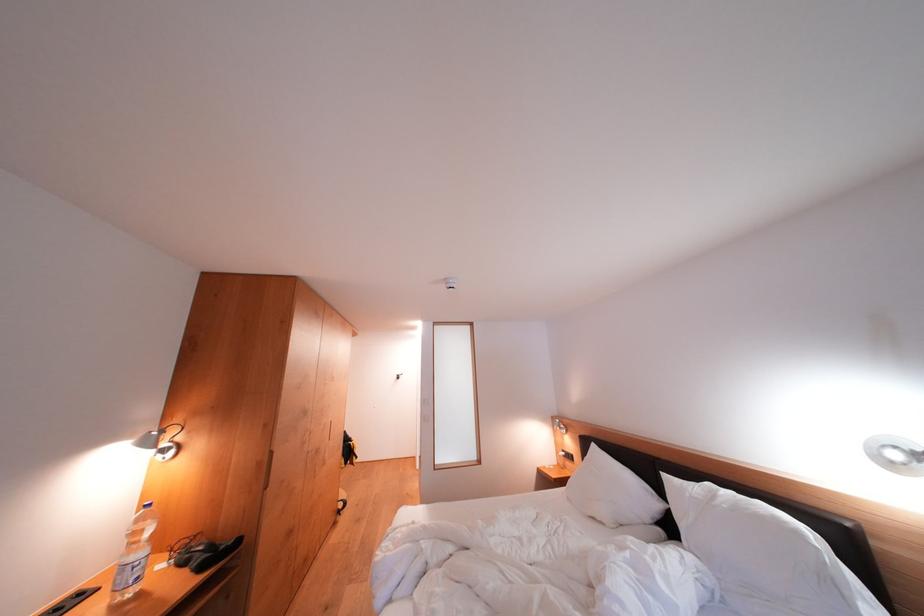
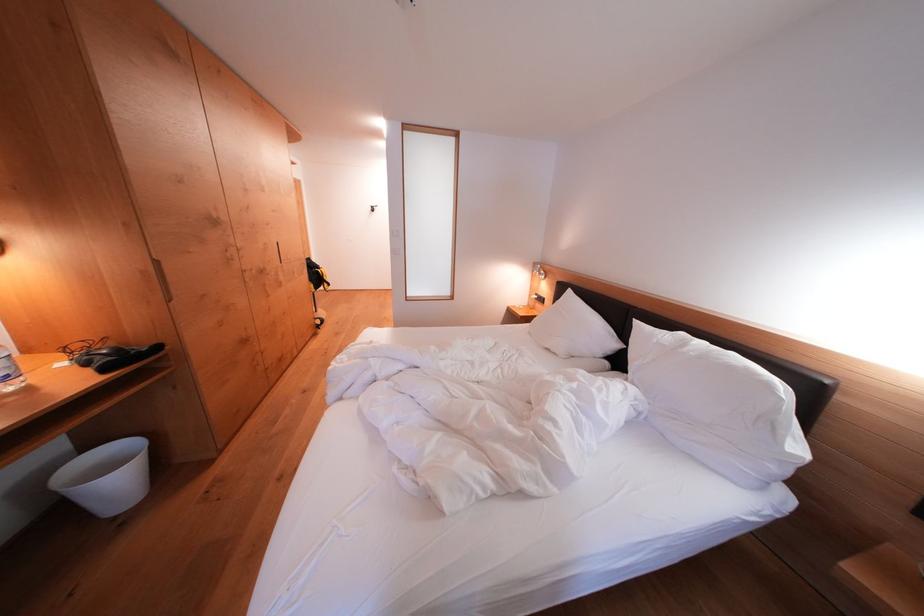
In the second image, find the point that corresponds to (x=551, y=424) in the first image.

(531, 269)